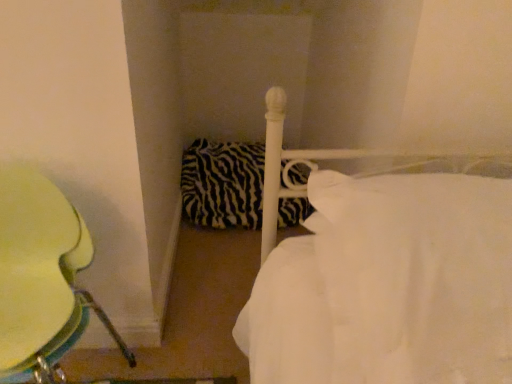
Question: Is white smooth bed at center surrounding metallic green chair at left?

Choices:
 (A) no
 (B) yes

Answer: (A)

Question: From a real-world perspective, is white smooth bed at center under metallic green chair at left?

Choices:
 (A) yes
 (B) no

Answer: (B)

Question: Considering the relative sizes of white smooth bed at center and metallic green chair at left in the image provided, is white smooth bed at center wider than metallic green chair at left?

Choices:
 (A) no
 (B) yes

Answer: (B)

Question: Considering the relative positions of white smooth bed at center and metallic green chair at left in the image provided, is white smooth bed at center to the left of metallic green chair at left from the viewer's perspective?

Choices:
 (A) no
 (B) yes

Answer: (A)

Question: From the image's perspective, would you say white smooth bed at center is shown under metallic green chair at left?

Choices:
 (A) no
 (B) yes

Answer: (A)

Question: From the image's perspective, relative to white smooth bed at center, is metallic green chair at left above or below?

Choices:
 (A) above
 (B) below

Answer: (B)

Question: In the image, is metallic green chair at left positioned in front of or behind white smooth bed at center?

Choices:
 (A) behind
 (B) front

Answer: (A)

Question: Is metallic green chair at left taller or shorter than white smooth bed at center?

Choices:
 (A) short
 (B) tall

Answer: (B)

Question: From a real-world perspective, is metallic green chair at left positioned above or below white smooth bed at center?

Choices:
 (A) below
 (B) above

Answer: (A)

Question: Would you say white smooth bed at center is inside or outside zebra-patterned fabric pillow at center?

Choices:
 (A) outside
 (B) inside

Answer: (A)

Question: From a real-world perspective, is white smooth bed at center positioned above or below zebra-patterned fabric pillow at center?

Choices:
 (A) below
 (B) above

Answer: (B)

Question: In terms of size, does white smooth bed at center appear bigger or smaller than zebra-patterned fabric pillow at center?

Choices:
 (A) big
 (B) small

Answer: (B)

Question: Considering their positions, is white smooth bed at center located in front of or behind zebra-patterned fabric pillow at center?

Choices:
 (A) front
 (B) behind

Answer: (A)

Question: Is white smooth bed at center wider or thinner than metallic green chair at left?

Choices:
 (A) wide
 (B) thin

Answer: (A)

Question: Is white smooth bed at center in front of or behind metallic green chair at left in the image?

Choices:
 (A) behind
 (B) front

Answer: (B)